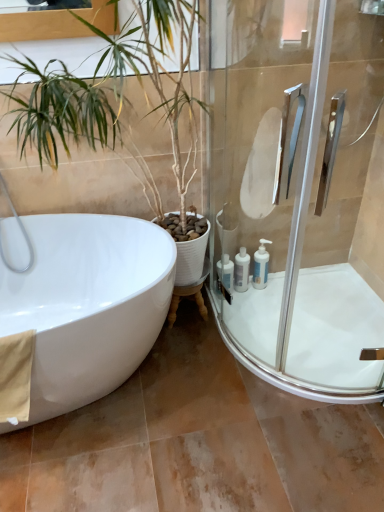
You are a GUI agent. You are given a task and a screenshot of the screen. Output one action in this format:
    pyautogui.click(x=<x>, y=<y>)
    Task: Click on the vacant space to the right of white glossy bottle at lower right, marked as the 2th toiletry in a right-to-left arrangement
    The width and height of the screenshot is (384, 512).
    Given the screenshot: What is the action you would take?
    pyautogui.click(x=266, y=297)